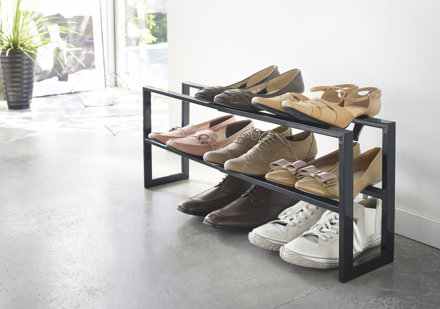
Identify the location of shoe on the top shelf of the shoe rack. The image size is (440, 309). (210, 95), (225, 98), (265, 100), (305, 110).